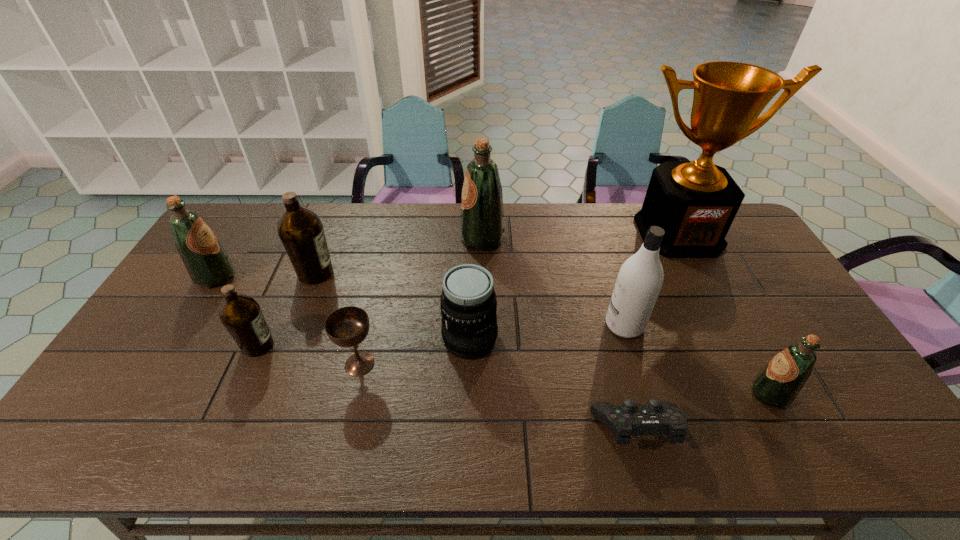
Locate which olive oil ranks fourth in proximity to the second nearest green olive oil. Please provide its 2D coordinates. Your answer should be formatted as a tuple, i.e. [(x, y)], where the tuple contains the x and y coordinates of a point satisfying the conditions above.

[(778, 384)]

Select which olive oil appears as the closest to the smallest green olive oil. Please provide its 2D coordinates. Your answer should be formatted as a tuple, i.e. [(x, y)], where the tuple contains the x and y coordinates of a point satisfying the conditions above.

[(482, 217)]

Identify which green olive oil is the closest to the white shampoo. Please provide its 2D coordinates. Your answer should be formatted as a tuple, i.e. [(x, y)], where the tuple contains the x and y coordinates of a point satisfying the conditions above.

[(778, 384)]

At what (x,y) coordinates should I click in order to perform the action: click on the second closest green olive oil to the leftmost olive oil. Please return your answer as a coordinate pair (x, y). This screenshot has width=960, height=540. Looking at the image, I should click on (778, 384).

Identify the location of vacant space that satisfies the following two spatial constraints: 1. on the label of the chalice; 2. on the right side of the fourth farthest olive oil. The height and width of the screenshot is (540, 960). (250, 364).

You are a GUI agent. You are given a task and a screenshot of the screen. Output one action in this format:
    pyautogui.click(x=<x>, y=<y>)
    Task: Click on the vacant space that satisfies the following two spatial constraints: 1. on the label of the farther brown olive oil; 2. on the right side of the shortest object
    The width and height of the screenshot is (960, 540).
    Given the screenshot: What is the action you would take?
    pyautogui.click(x=254, y=430)

Locate an element on the screen. This screenshot has height=540, width=960. vacant space that satisfies the following two spatial constraints: 1. on the label of the telephoto lens; 2. on the left side of the farther brown olive oil is located at coordinates (290, 339).